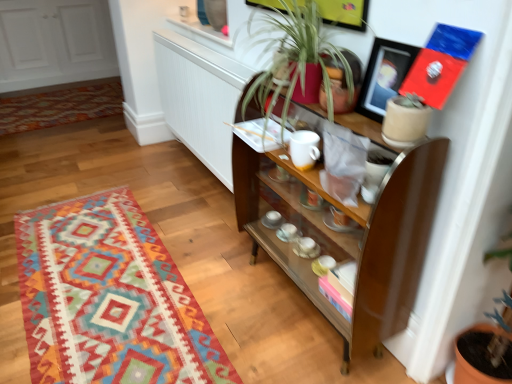
Question: From a real-world perspective, is textured wool rug at lower left, placed as the 1th mat when sorted from front to back, located higher than brown wooden shelf at center?

Choices:
 (A) no
 (B) yes

Answer: (A)

Question: Does textured wool rug at lower left, which is the second mat in top-to-bottom order, have a greater width compared to brown wooden shelf at center?

Choices:
 (A) yes
 (B) no

Answer: (A)

Question: Is textured wool rug at lower left, placed as the 1th mat when sorted from front to back, closer to camera compared to brown wooden shelf at center?

Choices:
 (A) yes
 (B) no

Answer: (B)

Question: From the image's perspective, would you say textured wool rug at lower left, which ranks as the 1th mat in bottom-to-top order, is shown under brown wooden shelf at center?

Choices:
 (A) yes
 (B) no

Answer: (A)

Question: Is the position of textured wool rug at lower left, which ranks as the 1th mat in bottom-to-top order, more distant than that of brown wooden shelf at center?

Choices:
 (A) yes
 (B) no

Answer: (A)

Question: Is multicolored woven rug at lower left, placed as the second mat when sorted from bottom to top, inside or outside of textured wool rug at lower left, which is the second mat in top-to-bottom order?

Choices:
 (A) outside
 (B) inside

Answer: (A)

Question: Is multicolored woven rug at lower left, positioned as the second mat in front-to-back order, to the left or to the right of textured wool rug at lower left, which is the second mat in top-to-bottom order, in the image?

Choices:
 (A) left
 (B) right

Answer: (A)

Question: Is multicolored woven rug at lower left, placed as the second mat when sorted from bottom to top, in front of or behind textured wool rug at lower left, placed as the 1th mat when sorted from front to back, in the image?

Choices:
 (A) front
 (B) behind

Answer: (B)

Question: From a real-world perspective, is multicolored woven rug at lower left, positioned as the second mat in front-to-back order, positioned above or below textured wool rug at lower left, placed as the 1th mat when sorted from front to back?

Choices:
 (A) below
 (B) above

Answer: (B)

Question: Would you say green leafy plant at center is to the left or to the right of multicolored woven rug at lower left, the first mat when ordered from back to front, in the picture?

Choices:
 (A) left
 (B) right

Answer: (B)

Question: From the image's perspective, is green leafy plant at center above or below multicolored woven rug at lower left, positioned as the second mat in front-to-back order?

Choices:
 (A) below
 (B) above

Answer: (A)

Question: Do you think green leafy plant at center is within multicolored woven rug at lower left, the first mat when ordered from back to front, or outside of it?

Choices:
 (A) inside
 (B) outside

Answer: (B)

Question: Is green leafy plant at center wider or thinner than multicolored woven rug at lower left, which is counted as the 1th mat, starting from the top?

Choices:
 (A) wide
 (B) thin

Answer: (B)

Question: Would you say brown wooden shelf at center is inside or outside multicolored woven rug at lower left, which is counted as the 1th mat, starting from the top?

Choices:
 (A) inside
 (B) outside

Answer: (B)

Question: Considering the relative positions of brown wooden shelf at center and multicolored woven rug at lower left, which is counted as the 1th mat, starting from the top, in the image provided, is brown wooden shelf at center to the left or to the right of multicolored woven rug at lower left, which is counted as the 1th mat, starting from the top,?

Choices:
 (A) right
 (B) left

Answer: (A)